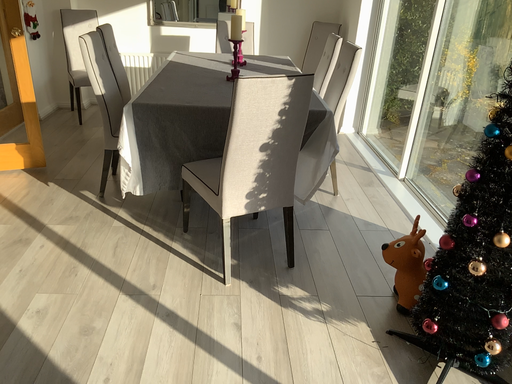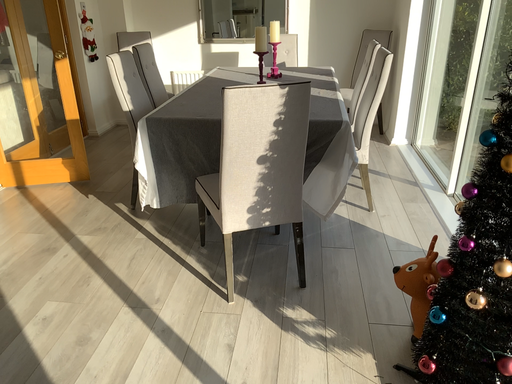
Question: Which way did the camera rotate in the video?

Choices:
 (A) rotated left
 (B) rotated right

Answer: (A)